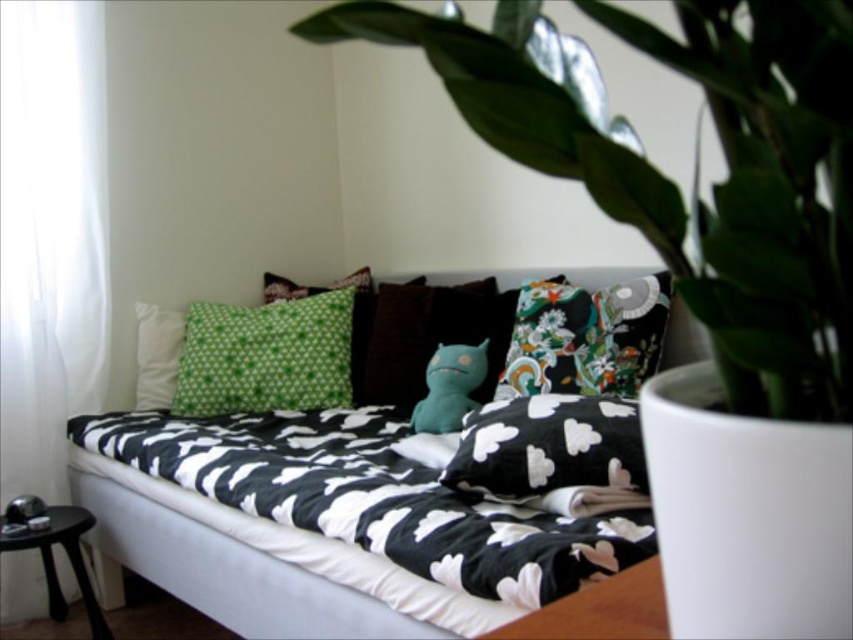
You are organizing a small event in this room and need to place a rectangular box that is 1.2 meters wide. You have to decide between placing it on the green fabric pillow at center or the black glossy stool at lower left. Which surface can accommodate the box based on their widths?

The green fabric pillow at center has a larger width than the black glossy stool at lower left, so the box can be placed on the green fabric pillow at center.